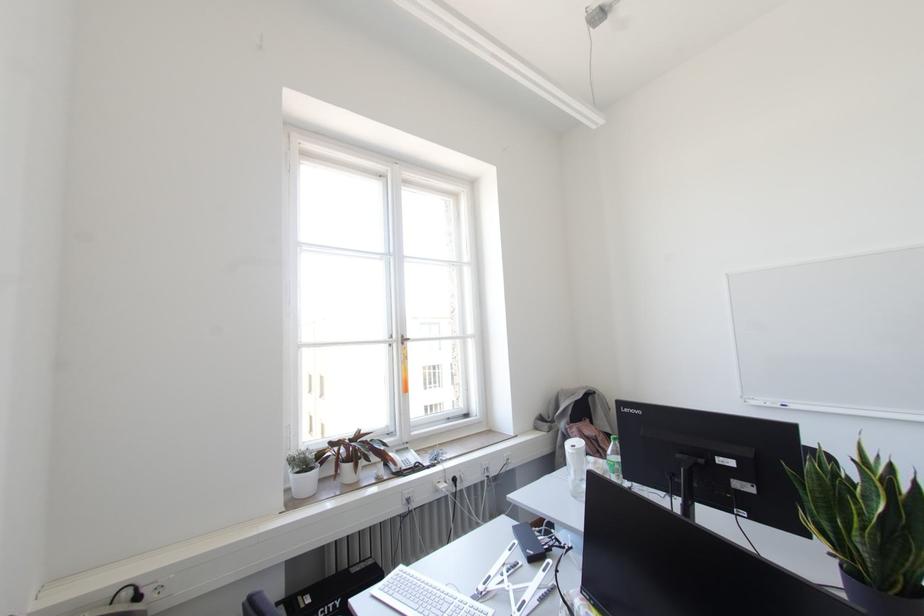
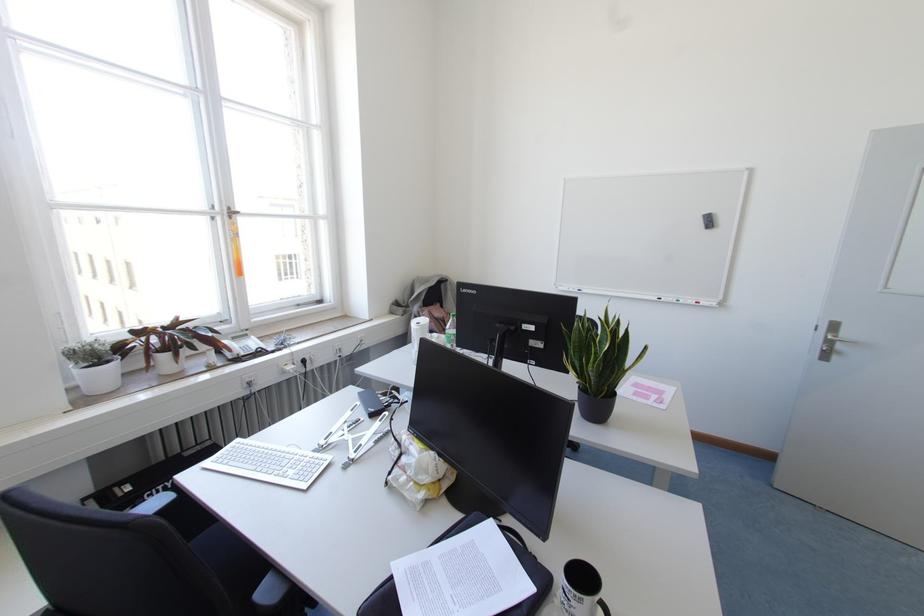
The point at (x=862, y=498) is marked in the first image. Where is the corresponding point in the second image?

(599, 342)